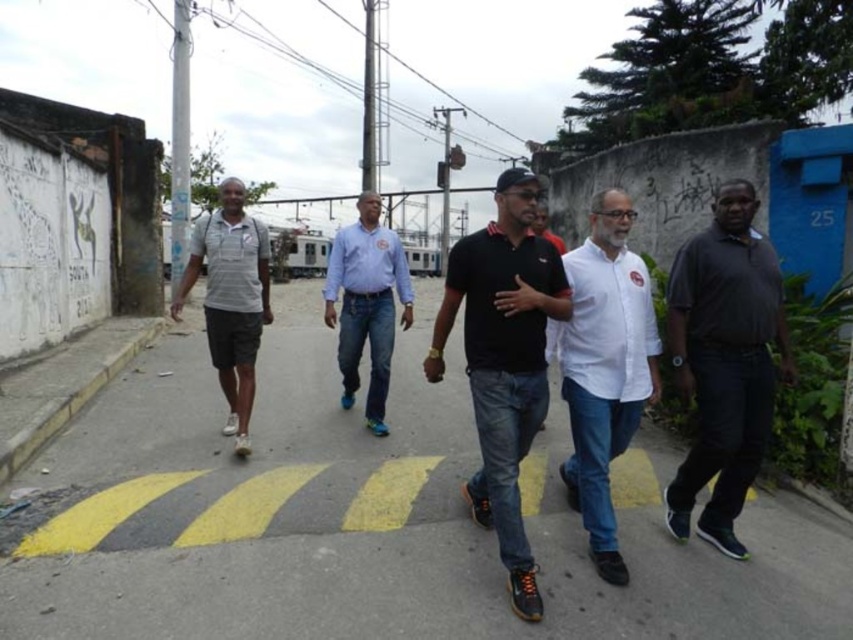
You are a delivery person carrying a large box that is 1.2 meters wide. You need to cross the yellow asphalt at center while avoiding the blue jeans at center. Is there enough space to pass safely?

Answer: The yellow asphalt at center might be wider than blue jeans at center, so there could be sufficient space to pass safely. However, since the exact width difference isn not specified, proceed with caution.

You are a photographer trying to capture a shot of the white matte shirt at center and the yellow asphalt at center. Which object will occupy more space in your photo?

The yellow asphalt at center is larger in size than the white matte shirt at center, so it will occupy more space in the photo.

You are standing at the origin point of the coordinate system in this image. Which direction should you move to reach the yellow asphalt at center?

The yellow asphalt at center is located at coordinate point (368, 520), so you should move towards the right and slightly upwards to reach it.